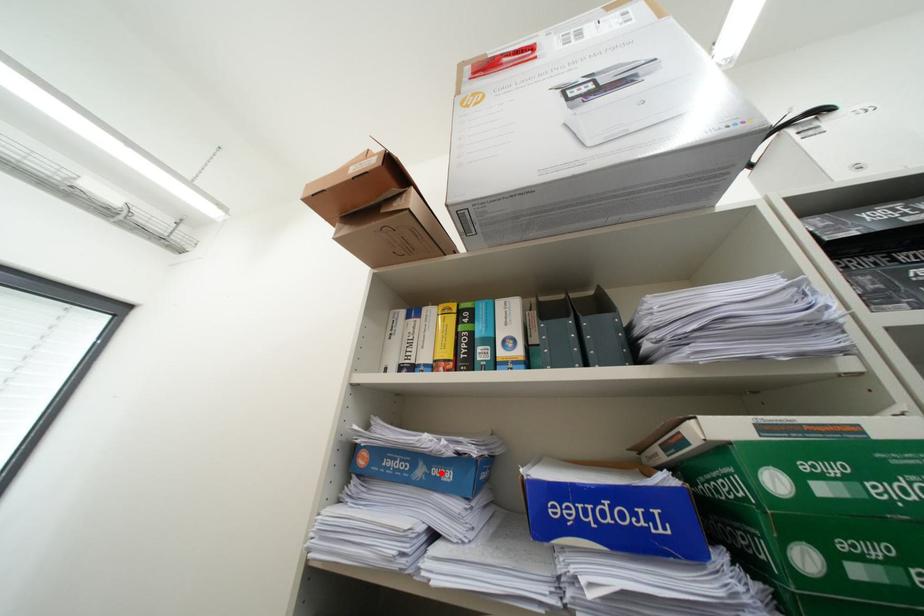
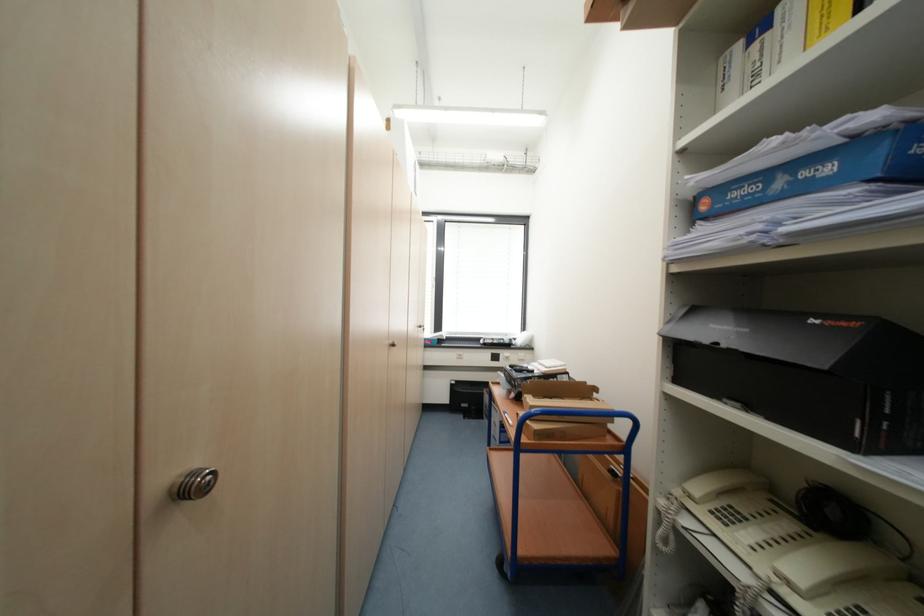
The point at the highlighted location is marked in the first image. Where is the corresponding point in the second image?

(810, 176)